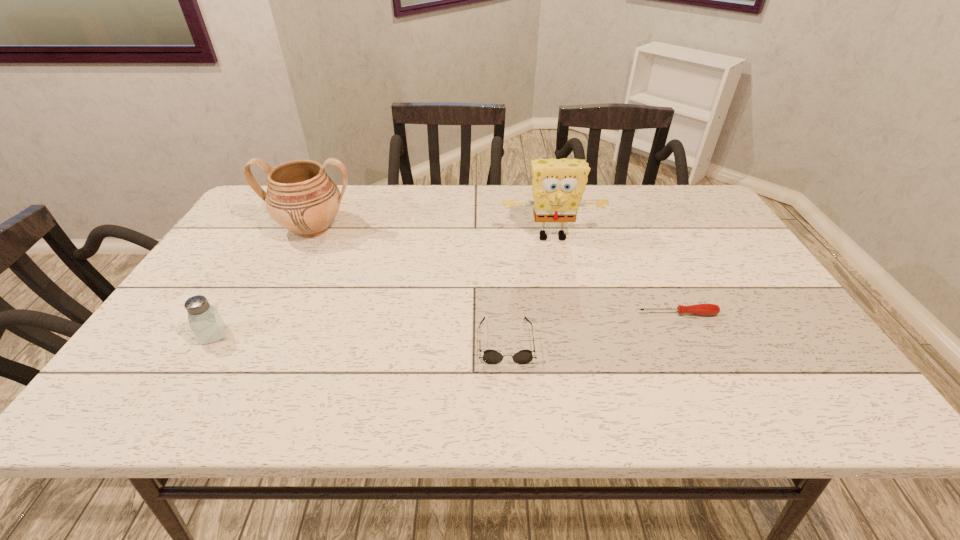
Select which object is the closest to the urn. Please provide its 2D coordinates. Your answer should be formatted as a tuple, i.e. [(x, y)], where the tuple contains the x and y coordinates of a point satisfying the conditions above.

[(208, 326)]

Locate an element on the screen. This screenshot has height=540, width=960. the closest object to the urn is located at coordinates (208, 326).

Identify the location of vacant space that satisfies the following two spatial constraints: 1. on the face of the shortest object; 2. on the right side of the sponge. Image resolution: width=960 pixels, height=540 pixels. click(568, 314).